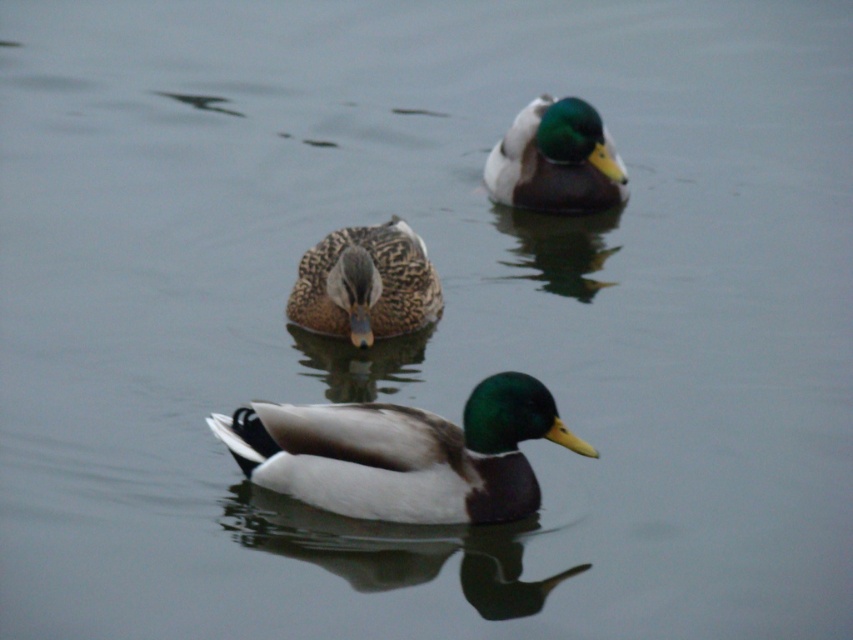
Is shiny white duck at center thinner than green glossy duck at upper center?

No.

How far apart are shiny white duck at center and green glossy duck at upper center?

shiny white duck at center is 3.58 meters from green glossy duck at upper center.

This screenshot has height=640, width=853. Identify the location of shiny white duck at center. click(402, 452).

Does speckled feather duck at center appear on the right side of green glossy duck at upper center?

Incorrect, speckled feather duck at center is not on the right side of green glossy duck at upper center.

Who is more forward, [364,280] or [492,156]?

Point [364,280]

Identify the location of speckled feather duck at center. The height and width of the screenshot is (640, 853). (364, 284).

Can you confirm if shiny white duck at center is wider than speckled feather duck at center?

Yes, shiny white duck at center is wider than speckled feather duck at center.

Is point (463, 442) more distant than point (389, 228)?

That is False.

Where is `shiny white duck at center`? This screenshot has height=640, width=853. shiny white duck at center is located at coordinates (402, 452).